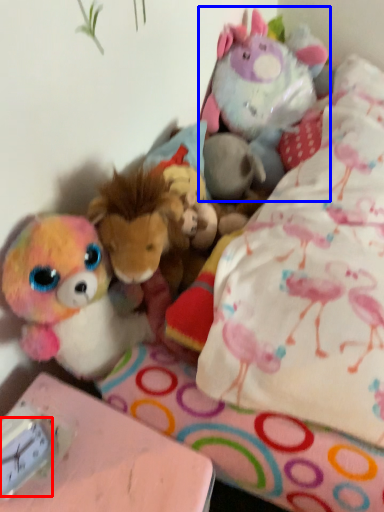
Question: Which point is further to the camera, clock (highlighted by a red box) or toy (highlighted by a blue box)?

Choices:
 (A) clock
 (B) toy

Answer: (B)